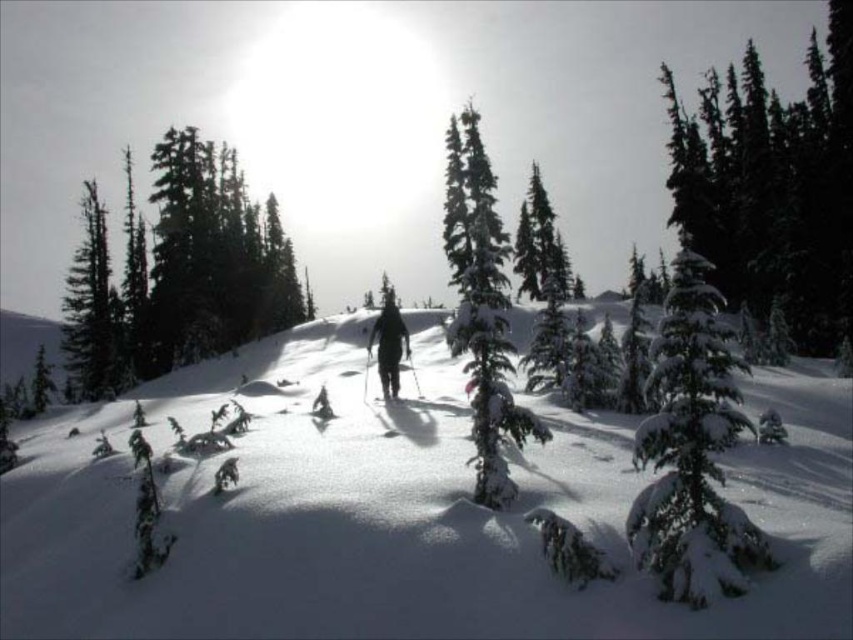
Question: Which point is closer to the camera?

Choices:
 (A) green textured pine tree at center
 (B) white fluffy snow at center

Answer: (B)

Question: Which point is farther to the camera?

Choices:
 (A) black matte person at center
 (B) green textured pine tree at center

Answer: (B)

Question: Is white fluffy snow at center wider than snow-covered evergreen at center-right?

Choices:
 (A) yes
 (B) no

Answer: (A)

Question: Does green textured pine tree at left appear on the right side of green textured pine tree at center?

Choices:
 (A) yes
 (B) no

Answer: (B)

Question: Which is farther from the white fluffy snow at center?

Choices:
 (A) black matte person at center
 (B) green matte tree at left

Answer: (B)

Question: Can you confirm if green textured pine tree at left is positioned to the left of matte black ski at center?

Choices:
 (A) no
 (B) yes

Answer: (B)